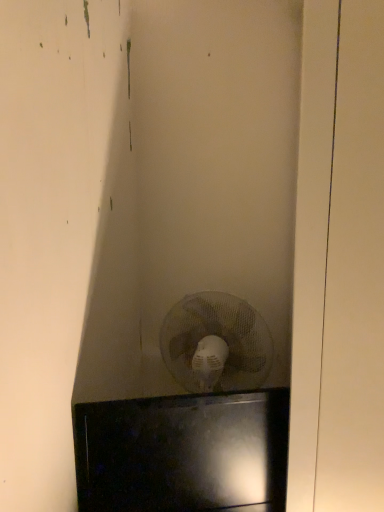
What is the approximate height of white mesh fan at center?

white mesh fan at center is 15.95 inches in height.

What do you see at coordinates (216, 343) in the screenshot? This screenshot has height=512, width=384. I see `white mesh fan at center` at bounding box center [216, 343].

The image size is (384, 512). Find the location of `white mesh fan at center`. white mesh fan at center is located at coordinates (216, 343).

The width and height of the screenshot is (384, 512). Identify the location of white mesh fan at center. (216, 343).